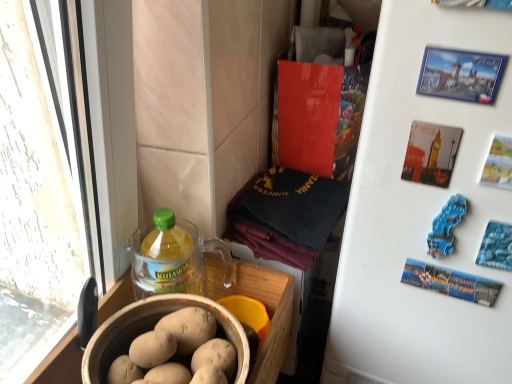
Question: Based on their positions, is blue plastic magnet at upper right located to the left or right of white matte refrigerator at upper right?

Choices:
 (A) left
 (B) right

Answer: (A)

Question: Is blue plastic magnet at upper right taller or shorter than white matte refrigerator at upper right?

Choices:
 (A) tall
 (B) short

Answer: (B)

Question: Estimate the real-world distances between objects in this image. Which object is farther from the matte brown bowl at lower left?

Choices:
 (A) white matte refrigerator at upper right
 (B) translucent plastic bottle at lower left
 (C) blue plastic magnet at upper right

Answer: (C)

Question: Which object is the farthest from the translucent plastic bottle at lower left?

Choices:
 (A) blue plastic magnet at upper right
 (B) matte brown bowl at lower left
 (C) white matte refrigerator at upper right

Answer: (A)